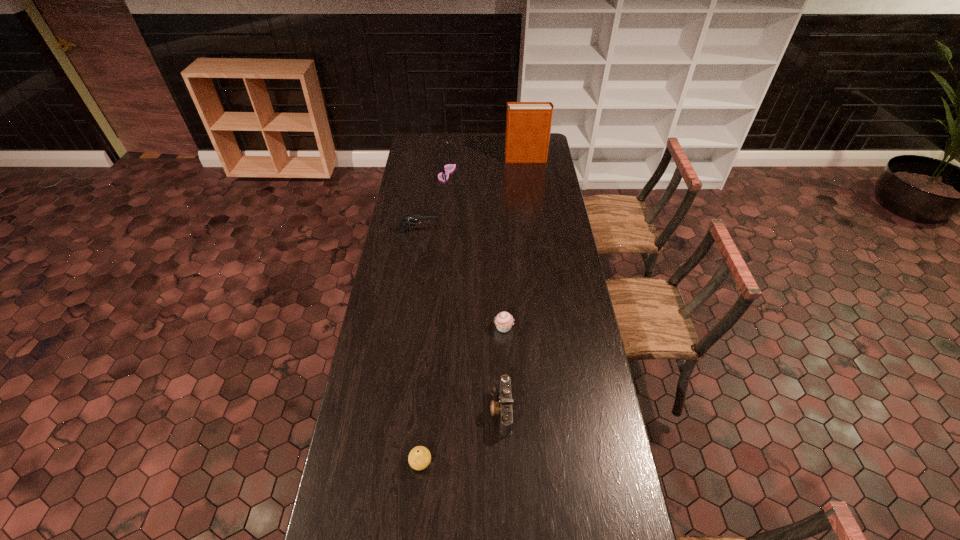
At what (x,y) coordinates should I click in order to perform the action: click on free space at the far edge of the desktop. Please return your answer as a coordinate pair (x, y). Looking at the image, I should click on (487, 140).

Image resolution: width=960 pixels, height=540 pixels. I want to click on free space at the left edge, so click(355, 420).

The image size is (960, 540). In the image, there is a desktop. In order to click on free space at the right edge in this screenshot , I will do `click(604, 401)`.

Where is `free space between the fifth nearest object and the gun`? The image size is (960, 540). free space between the fifth nearest object and the gun is located at coordinates (433, 202).

The width and height of the screenshot is (960, 540). What are the coordinates of `free point between the hardback book and the cupcake` in the screenshot? It's located at (515, 243).

Where is `vacant space that is in between the spectacles and the camera`? The height and width of the screenshot is (540, 960). vacant space that is in between the spectacles and the camera is located at coordinates (474, 292).

Locate an element on the screen. The image size is (960, 540). blank region between the pear and the hardback book is located at coordinates (473, 310).

The height and width of the screenshot is (540, 960). I want to click on free area in between the spectacles and the fourth nearest object, so [x=433, y=202].

Identify the location of vacant area between the spectacles and the camera. The height and width of the screenshot is (540, 960). (474, 292).

The height and width of the screenshot is (540, 960). I want to click on empty location between the third nearest object and the gun, so click(x=462, y=279).